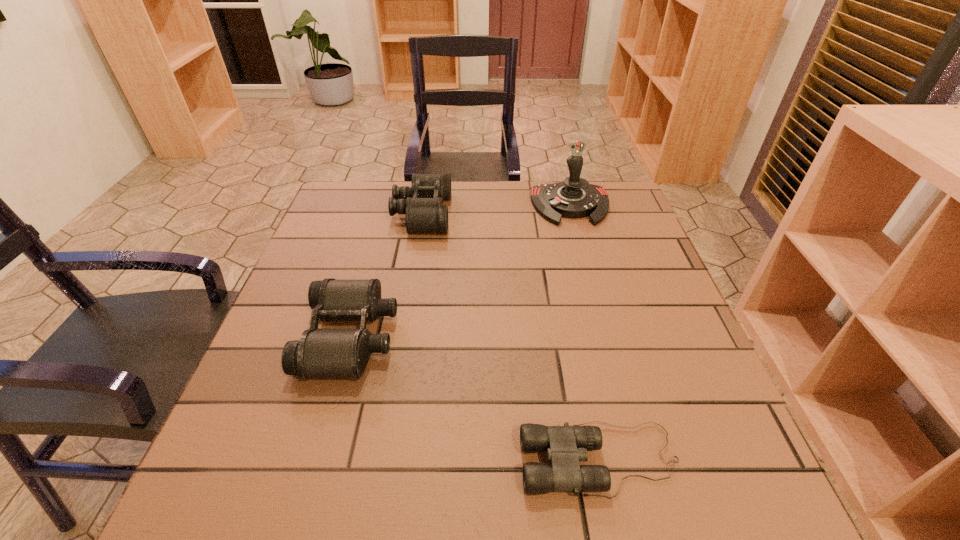
Identify the location of free space between the shortest binoculars and the farthest binoculars. (511, 337).

Locate an element on the screen. The width and height of the screenshot is (960, 540). blank region between the rightmost binoculars and the second nearest object is located at coordinates (475, 399).

Find the location of `empty location between the farthest binoculars and the third farthest object`. empty location between the farthest binoculars and the third farthest object is located at coordinates (386, 275).

Identify the location of vacant area between the joystick and the second nearest binoculars. (461, 271).

This screenshot has height=540, width=960. I want to click on object that is the closest to the second farthest binoculars, so click(x=421, y=203).

Find the location of a particular element. The image size is (960, 540). object that is the closest to the shortest binoculars is located at coordinates [x=320, y=353].

Locate an element on the screen. binoculars that is the closest one to the tallest object is located at coordinates (421, 203).

Image resolution: width=960 pixels, height=540 pixels. I want to click on binoculars that is the second closest to the nearest object, so (x=421, y=203).

Where is `vacant area in the image that satisfies the following two spatial constraints: 1. on the handle side of the joystick; 2. through the eyepieces of the third farthest object`? vacant area in the image that satisfies the following two spatial constraints: 1. on the handle side of the joystick; 2. through the eyepieces of the third farthest object is located at coordinates click(607, 336).

Identify the location of vacant space that satisfies the following two spatial constraints: 1. on the handle side of the joystick; 2. through the eyepieces of the second farthest binoculars. The height and width of the screenshot is (540, 960). (607, 336).